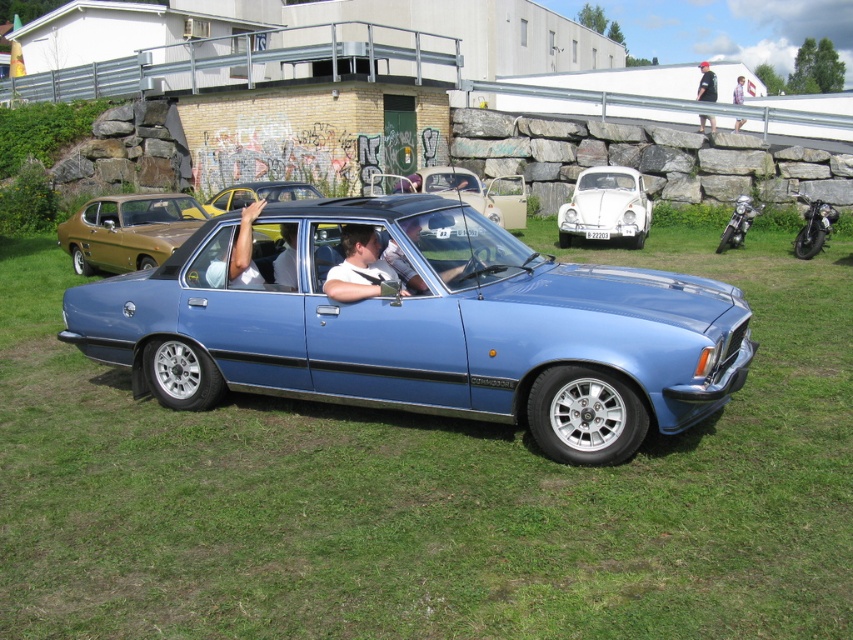
Question: Considering the real-world distances, which object is farthest from the light blue shirt at upper center?

Choices:
 (A) white fabric shirt at upper center
 (B) white matte shirt at center
 (C) beige matte convertible at center
 (D) gold metallic coupe at left

Answer: (B)

Question: Does blue metallic car at center have a lesser width compared to white matte shirt at center?

Choices:
 (A) no
 (B) yes

Answer: (A)

Question: Can you confirm if matte black car at center is positioned below white fabric shirt at upper center?

Choices:
 (A) no
 (B) yes

Answer: (B)

Question: Which of the following is the farthest from the observer?

Choices:
 (A) beige matte convertible at center
 (B) gold metallic coupe at left
 (C) blue metallic car at center
 (D) black plastic license plate at center

Answer: (A)

Question: Can you confirm if gold metallic coupe at left is positioned above light blue shirt at upper center?

Choices:
 (A) no
 (B) yes

Answer: (A)

Question: Which point is farther to the camera?

Choices:
 (A) gold metallic coupe at left
 (B) matte black car at center

Answer: (A)